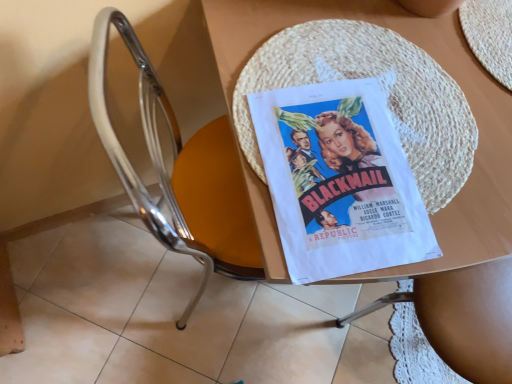
Question: Is wooden table at center not near metallic chrome chair at center?

Choices:
 (A) yes
 (B) no

Answer: (B)

Question: Is wooden table at center located outside metallic chrome chair at center?

Choices:
 (A) no
 (B) yes

Answer: (B)

Question: Is the position of wooden table at center more distant than that of metallic chrome chair at center?

Choices:
 (A) yes
 (B) no

Answer: (A)

Question: Is wooden table at center positioned before metallic chrome chair at center?

Choices:
 (A) yes
 (B) no

Answer: (B)

Question: From a real-world perspective, does wooden table at center sit lower than metallic chrome chair at center?

Choices:
 (A) yes
 (B) no

Answer: (A)

Question: From a real-world perspective, is wooden table at center located higher than metallic chrome chair at center?

Choices:
 (A) yes
 (B) no

Answer: (B)

Question: Is white paper poster at center behind wooden table at center?

Choices:
 (A) no
 (B) yes

Answer: (B)

Question: From the image's perspective, would you say white paper poster at center is shown under wooden table at center?

Choices:
 (A) no
 (B) yes

Answer: (B)

Question: Does white paper poster at center appear on the right side of wooden table at center?

Choices:
 (A) no
 (B) yes

Answer: (A)

Question: Is the position of white paper poster at center less distant than that of wooden table at center?

Choices:
 (A) no
 (B) yes

Answer: (A)

Question: Is white paper poster at center in contact with wooden table at center?

Choices:
 (A) no
 (B) yes

Answer: (B)

Question: Is white paper poster at center looking in the opposite direction of wooden table at center?

Choices:
 (A) yes
 (B) no

Answer: (A)

Question: Does wooden table at center turn towards white paper poster at center?

Choices:
 (A) yes
 (B) no

Answer: (B)